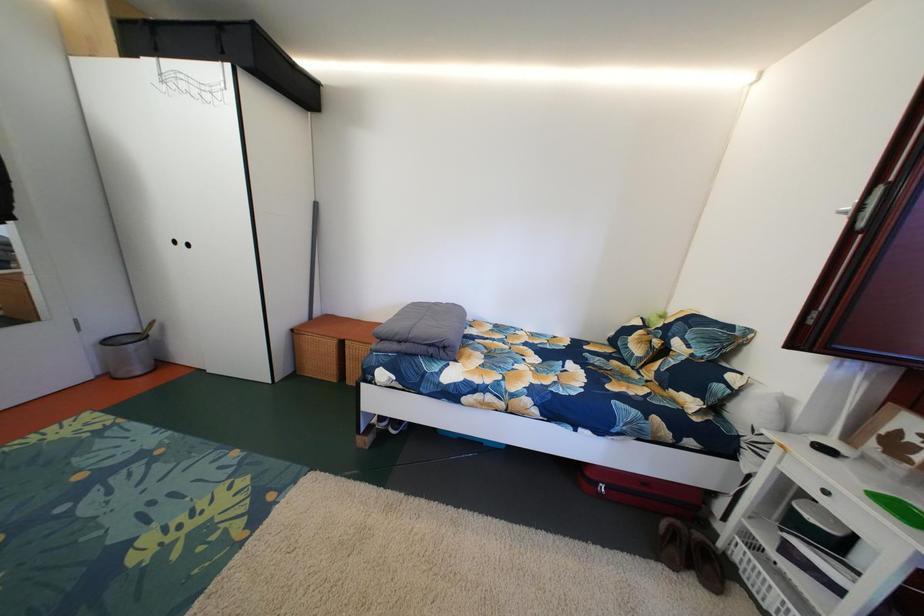
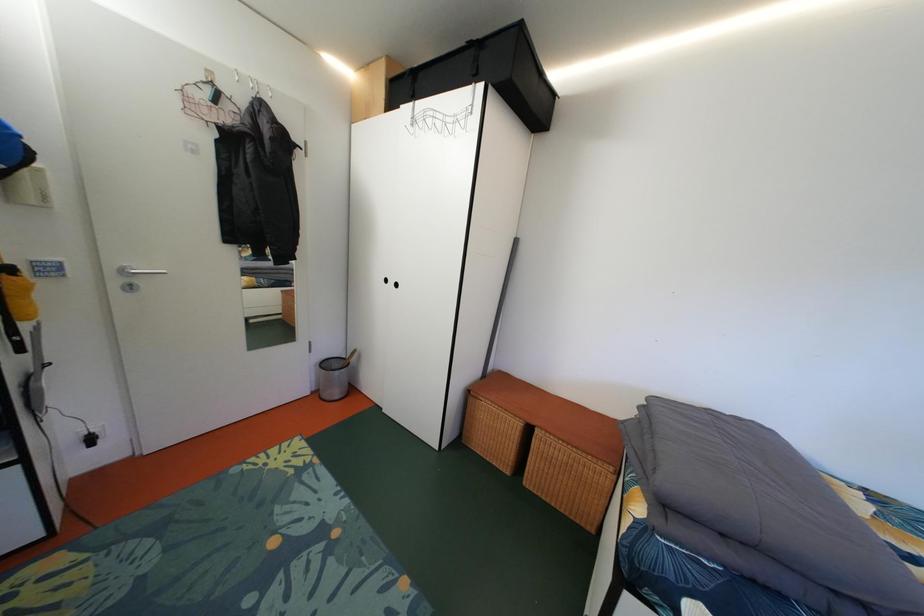
Question: The images are taken continuously from a first-person perspective. In which direction is your viewpoint rotating?

Choices:
 (A) Left
 (B) Right
 (C) Up
 (D) Down

Answer: (A)